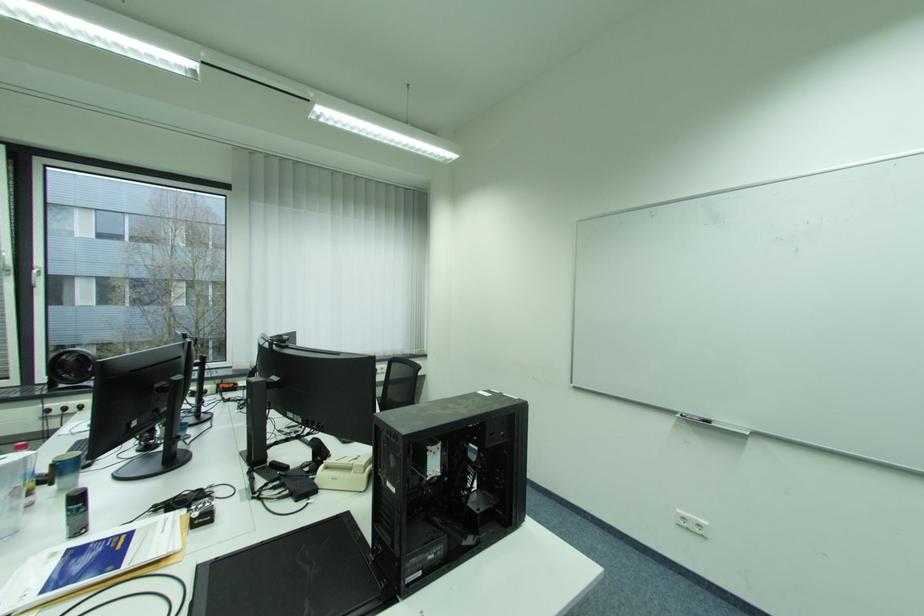
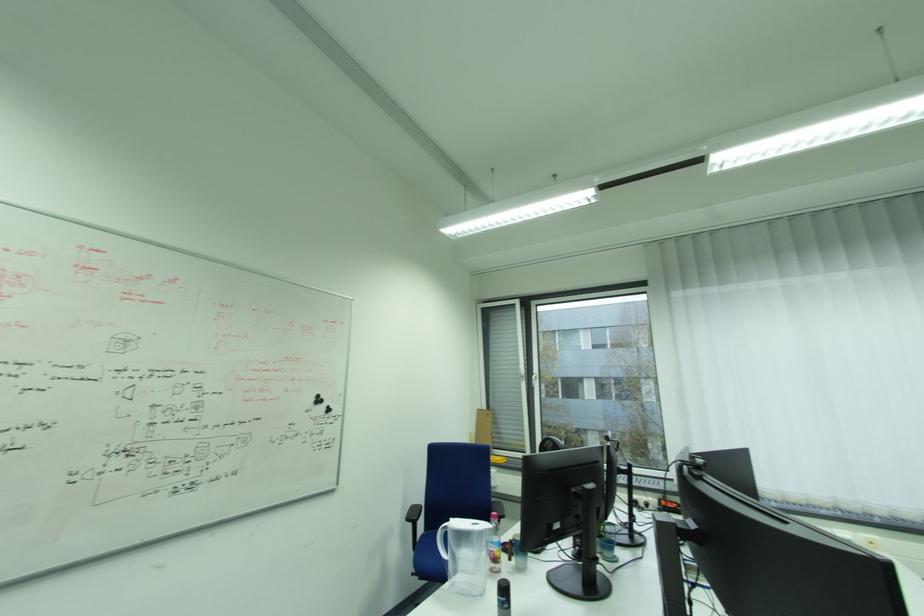
In the second image, find the point that corresponds to point (78, 511) in the first image.

(505, 600)